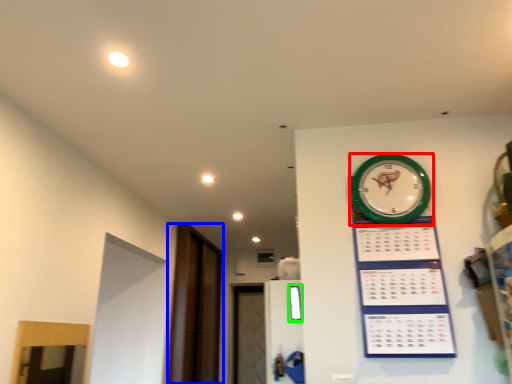
Question: Based on their relative distances, which object is nearer to wall clock (highlighted by a red box)? Choose from glass door (highlighted by a blue box) and window (highlighted by a green box).

Choices:
 (A) glass door
 (B) window

Answer: (B)